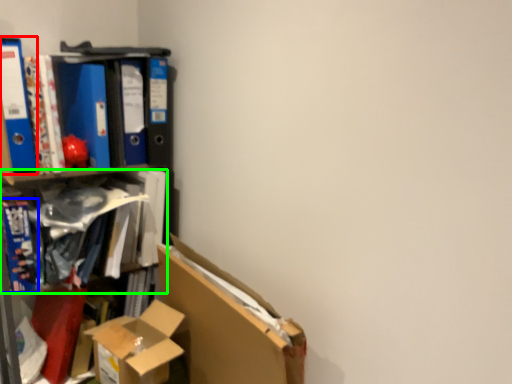
Question: Which object is positioned closest to paperback book (highlighted by a red box)? Select from book (highlighted by a blue box) and book (highlighted by a green box).

Choices:
 (A) book
 (B) book

Answer: (A)